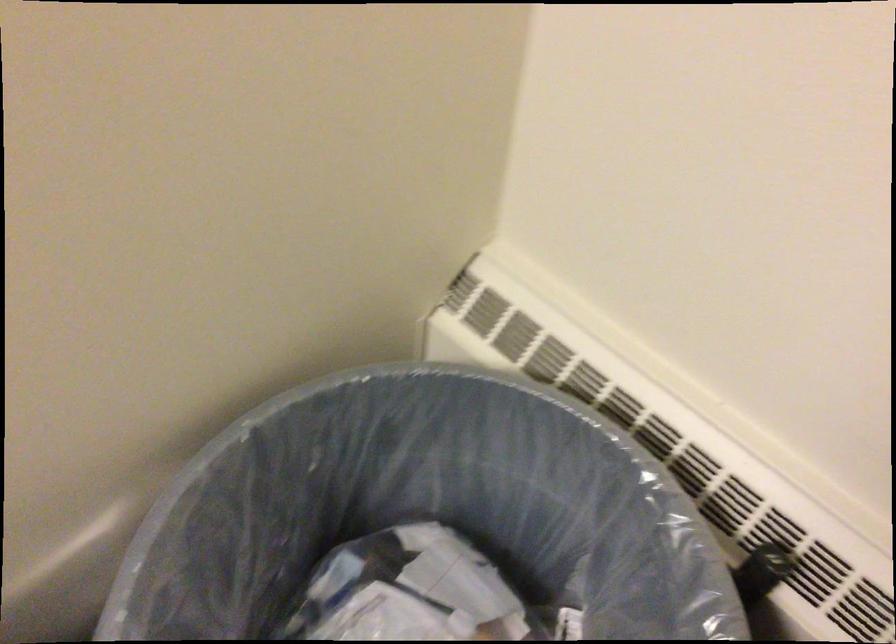
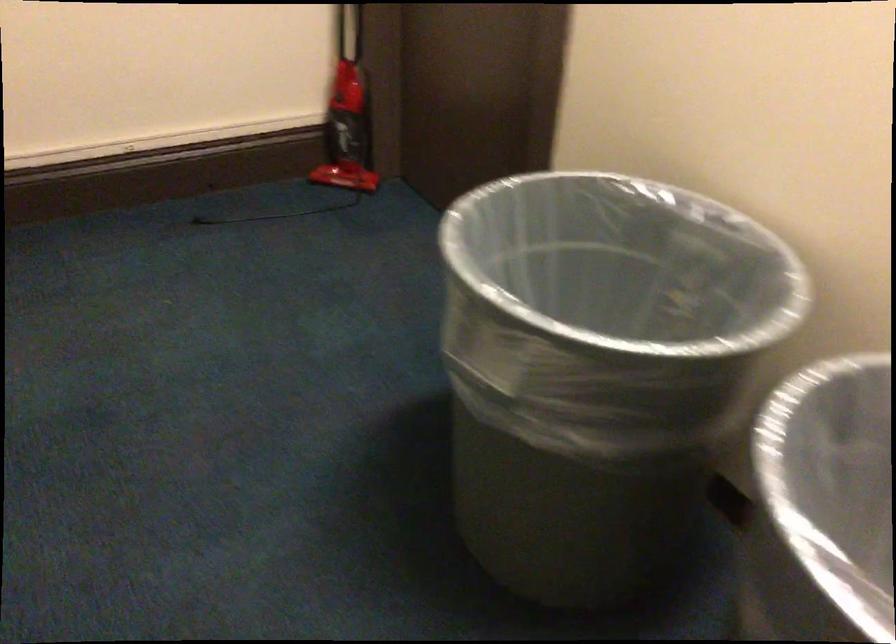
Based on the continuous images, in which direction is the camera rotating?

The camera rotated toward left-down.